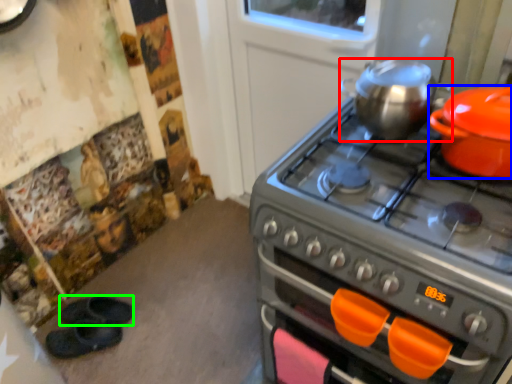
Question: Estimate the real-world distances between objects in this image. Which object is closer to kitchen appliance (highlighted by a red box), kitchen appliance (highlighted by a blue box) or footwear (highlighted by a green box)?

Choices:
 (A) kitchen appliance
 (B) footwear

Answer: (A)